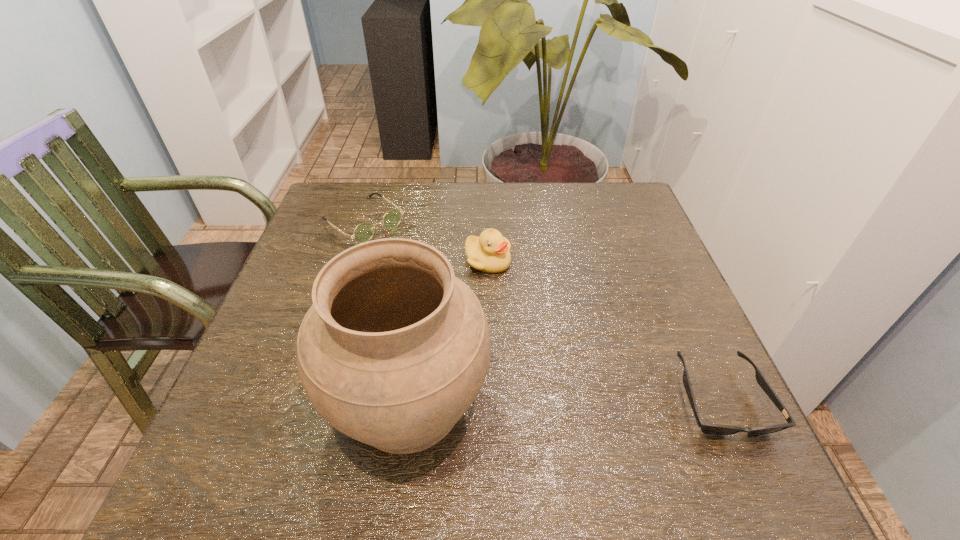
The width and height of the screenshot is (960, 540). In order to click on free space on the desktop that is between the urn and the shortest object and is positioned on the front-facing side of the second tallest object in this screenshot , I will do `click(563, 401)`.

Where is `free space on the desktop that is between the urn and the shortest object and is positioned on the lenses of the third tallest object`? This screenshot has height=540, width=960. free space on the desktop that is between the urn and the shortest object and is positioned on the lenses of the third tallest object is located at coordinates (x=592, y=401).